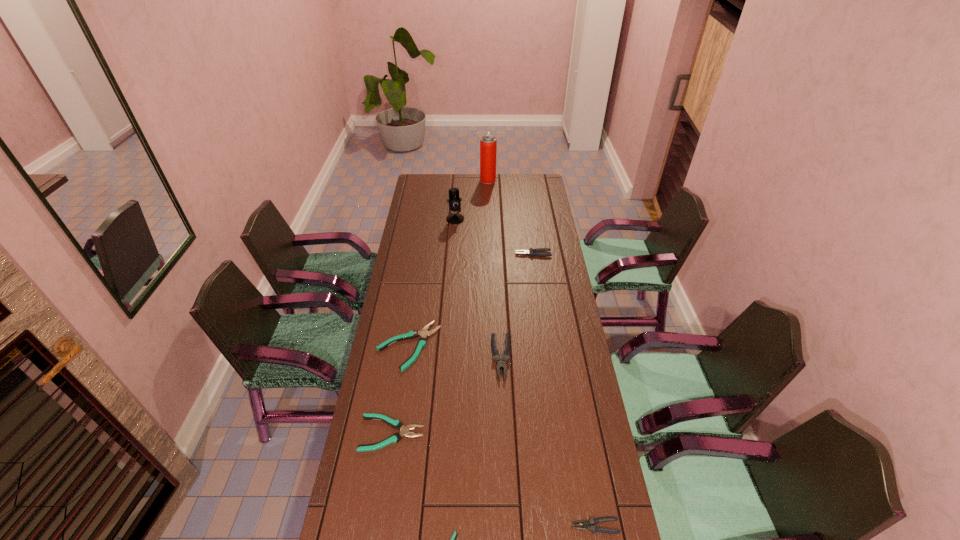
Locate an element on the screen. vacant region between the smallest gray pliers and the aerosol can is located at coordinates (541, 353).

Locate an element on the screen. The height and width of the screenshot is (540, 960). free spot between the biggest teal pliers and the smallest gray pliers is located at coordinates tap(502, 436).

Image resolution: width=960 pixels, height=540 pixels. I want to click on free space between the second smallest gray pliers and the farthest teal pliers, so click(x=471, y=300).

You are a GUI agent. You are given a task and a screenshot of the screen. Output one action in this format:
    pyautogui.click(x=<x>, y=<y>)
    Task: Click on the object that stands as the fifth closest to the second biggest gray pliers
    Image resolution: width=960 pixels, height=540 pixels.
    Given the screenshot: What is the action you would take?
    pyautogui.click(x=397, y=424)

Identify the location of object identified as the sixth closest to the nearest teal pliers. click(454, 200).

Identify which pliers is the fourth nearest to the farthest teal pliers. Please provide its 2D coordinates. Your answer should be formatted as a tuple, i.e. [(x, y)], where the tuple contains the x and y coordinates of a point satisfying the conditions above.

[(453, 539)]

I want to click on the third closest pliers to the biggest teal pliers, so click(532, 252).

Where is `gray pliers that stands as the second closest to the biggest gray pliers`? This screenshot has width=960, height=540. gray pliers that stands as the second closest to the biggest gray pliers is located at coordinates (532, 252).

This screenshot has width=960, height=540. I want to click on gray pliers that stands as the closest to the nearest gray pliers, so click(500, 363).

The image size is (960, 540). In order to click on teal pliers that can be found as the closest to the biggest teal pliers in this screenshot , I will do `click(397, 424)`.